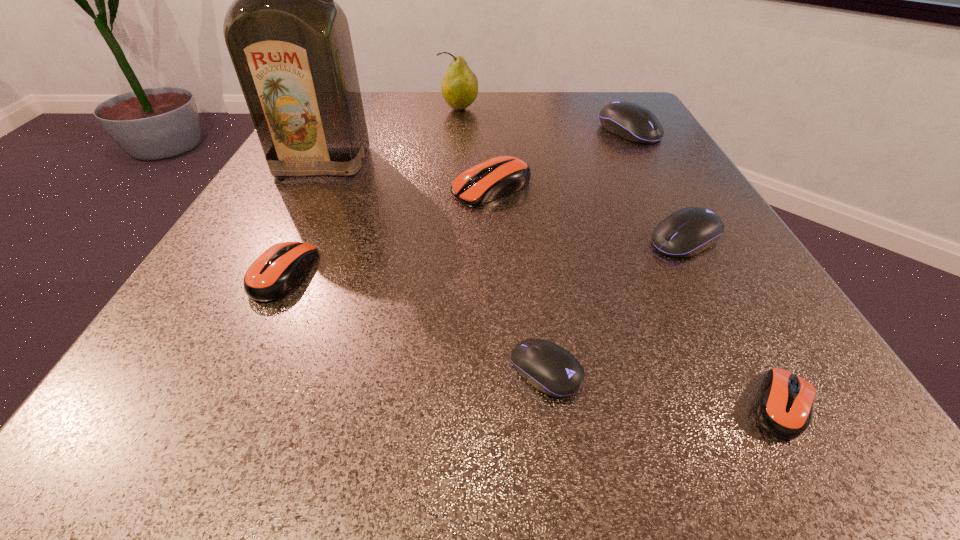
Identify the location of the leftmost black computer mouse. (551, 369).

The image size is (960, 540). Find the location of `the nearest black computer mouse`. the nearest black computer mouse is located at coordinates (551, 369).

Image resolution: width=960 pixels, height=540 pixels. What are the coordinates of `the rightmost orange computer mouse` in the screenshot? It's located at (785, 408).

Locate an element on the screen. This screenshot has width=960, height=540. the shortest object is located at coordinates (785, 408).

Find the location of a particular element. The height and width of the screenshot is (540, 960). vacant area situated on the label of the liquor is located at coordinates (267, 271).

Image resolution: width=960 pixels, height=540 pixels. Find the location of `vacant space located 0.180m on the right of the farthest object`. vacant space located 0.180m on the right of the farthest object is located at coordinates (556, 109).

Where is `vacant space positioned 0.270m on the front of the tallest computer mouse`? vacant space positioned 0.270m on the front of the tallest computer mouse is located at coordinates (683, 225).

The height and width of the screenshot is (540, 960). Identify the location of free space located 0.160m on the left of the fifth nearest computer mouse. (360, 188).

The width and height of the screenshot is (960, 540). I want to click on free spot located on the left of the second smallest black computer mouse, so click(x=588, y=239).

Find the location of `vacant space located 0.290m on the back of the leftmost computer mouse`. vacant space located 0.290m on the back of the leftmost computer mouse is located at coordinates (342, 153).